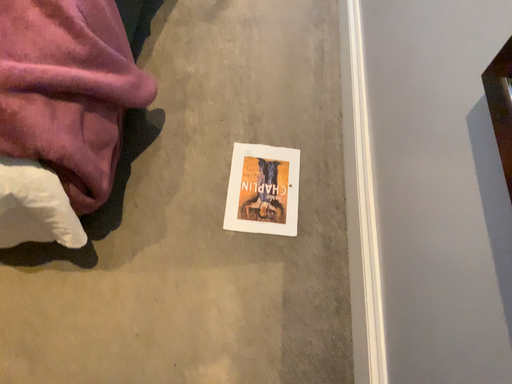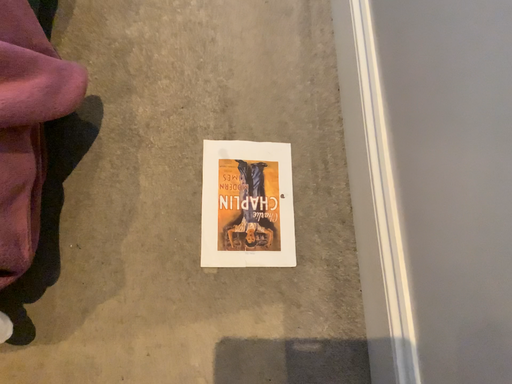
Question: How did the camera likely rotate when shooting the video?

Choices:
 (A) rotated left
 (B) rotated right

Answer: (B)